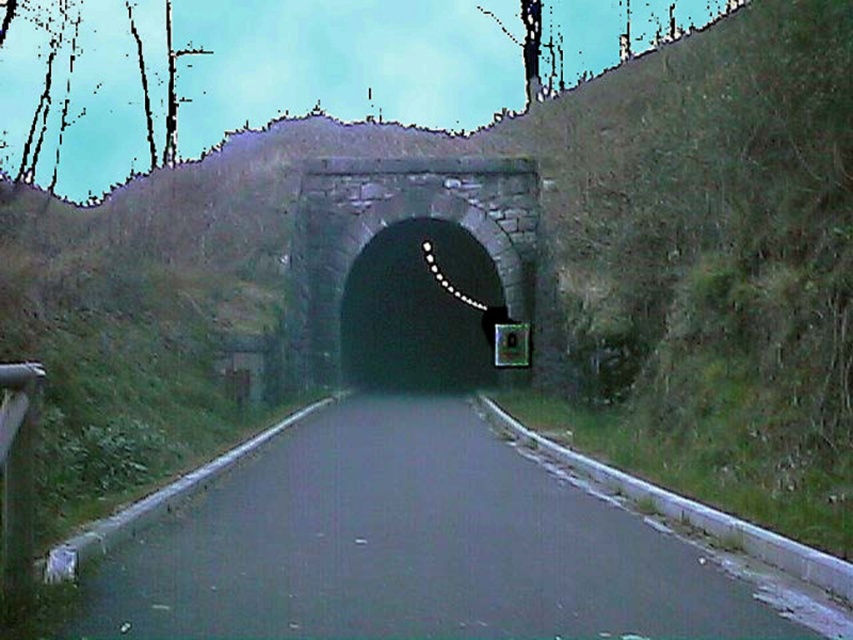
You are standing at the entrance of the tunnel and see two points marked on the road ahead. The first point is at coordinates point (177, 634) and the second is at point (320, 358). Which point is closer to you?

Point (177, 634) is closer to the viewer than point (320, 358).

You are driving a car and see the asphalt road at center and the dark stone tunnel at center ahead. Which one is positioned to the right side from your perspective?

The asphalt road at center is positioned to the right of the dark stone tunnel at center, so the asphalt road at center is on the right side.